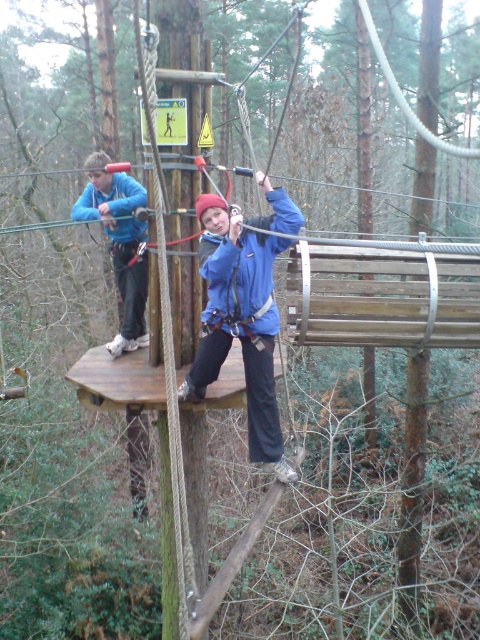
Is blue fabric jacket at center taller than matte blue jacket at center?

Yes, blue fabric jacket at center is taller than matte blue jacket at center.

Can you confirm if blue fabric jacket at center is shorter than matte blue jacket at center?

Incorrect, blue fabric jacket at center's height does not fall short of matte blue jacket at center's.

Is point (201, 221) positioned behind point (132, 340)?

No, (201, 221) is closer to viewer.

Locate an element on the screen. blue fabric jacket at center is located at coordinates (240, 323).